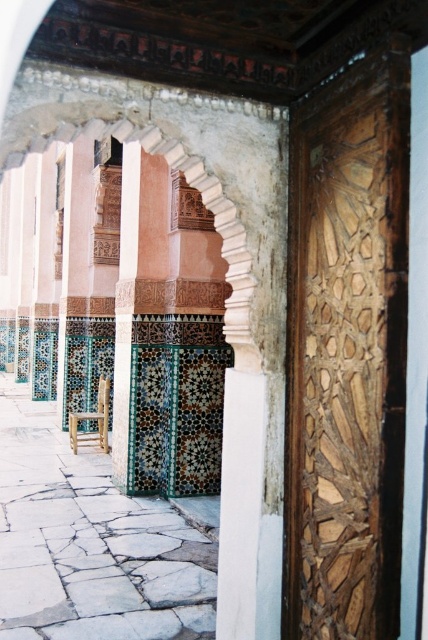
You are an interior designer planning to place a new decorative item in the space shown. You have a choice between placing it on the green mosaic tile at center or the wooden chair at center. Considering their positions, which surface is higher and thus more suitable for visibility?

The green mosaic tile at center is positioned over the wooden chair at center, meaning it is higher. Therefore, placing the decorative item on the green mosaic tile at center would provide better visibility.

You are standing in front of the carved wooden door frame and want to move towards the green mosaic tile at center. Is the wooden chair at center blocking your path?

The green mosaic tile at center is in front of the wooden chair at center, meaning the wooden chair at center is between you and the tile. Therefore, the wooden chair at center is blocking your path to the green mosaic tile at center.

You are an architect designing a new tile pattern for a historical building. You want to place a new tile exactly at the center of the existing green mosaic tile at center. What coordinates should you use?

The coordinates for the green mosaic tile at center are at point (x=125, y=308). Therefore, you should place the new tile at those exact coordinates to align it with the existing green mosaic tile at center.